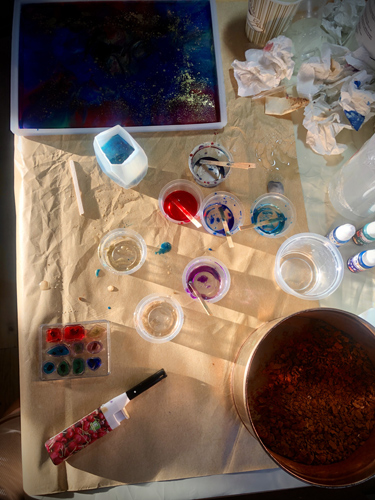
The height and width of the screenshot is (500, 375). In order to click on craft paper in this screenshot , I will do `click(169, 412)`.